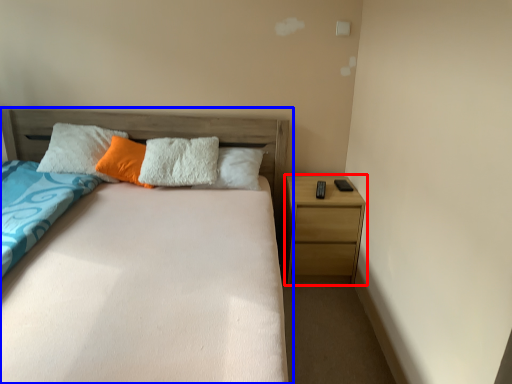
Question: Among these objects, which one is nearest to the camera, nightstand (highlighted by a red box) or bed (highlighted by a blue box)?

Choices:
 (A) nightstand
 (B) bed

Answer: (B)